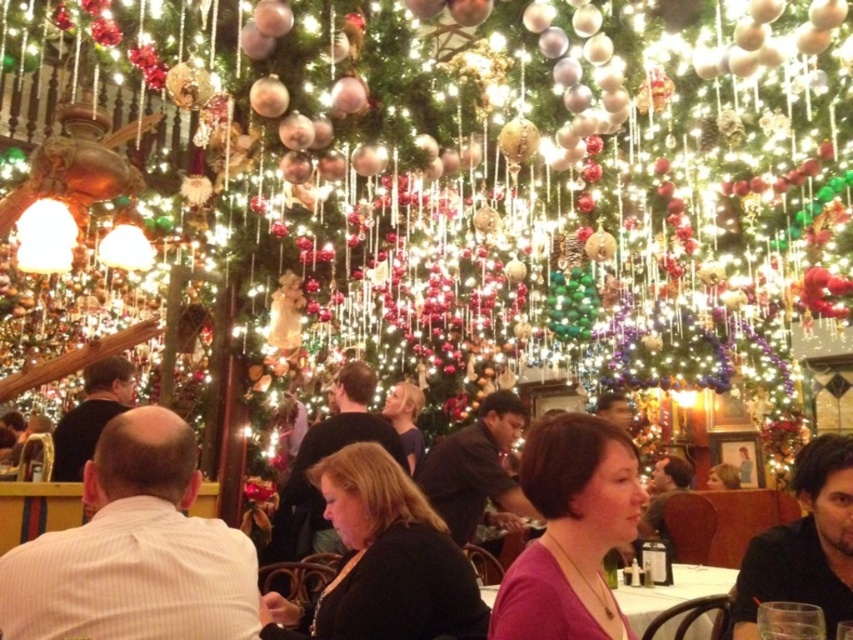
From the picture: You are a photographer at the event and want to take a photo of both the black matte shirt at lower right and the dark brown shirt at center. However, you can only focus on one person at a time. Which shirt should you focus on to ensure the other is still visible in the background?

You should focus on the black matte shirt at lower right because it is in front of the dark brown shirt at center, so the dark brown shirt at center will be visible in the background when the black matte shirt at lower right is in focus.

You are a photographer at the event and want to take a photo of both the black matte shirt at lower right and the dark brown shirt at center. Since you can only focus on one shirt at a time, which shirt should you focus on to ensure the other appears in the background?

You should focus on the dark brown shirt at center because it is taller than the black matte shirt at lower right, so the shorter black matte shirt at lower right will naturally appear in the background.